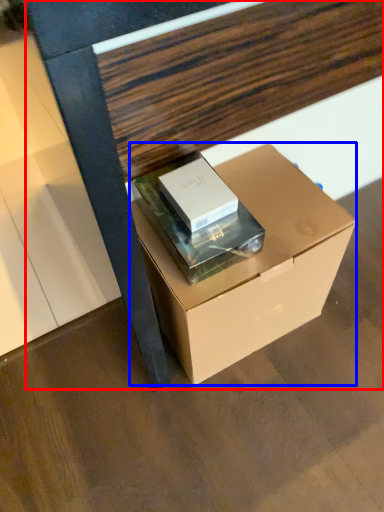
Question: Which of the following is the farthest to the observer, furniture (highlighted by a red box) or box (highlighted by a blue box)?

Choices:
 (A) furniture
 (B) box

Answer: (B)